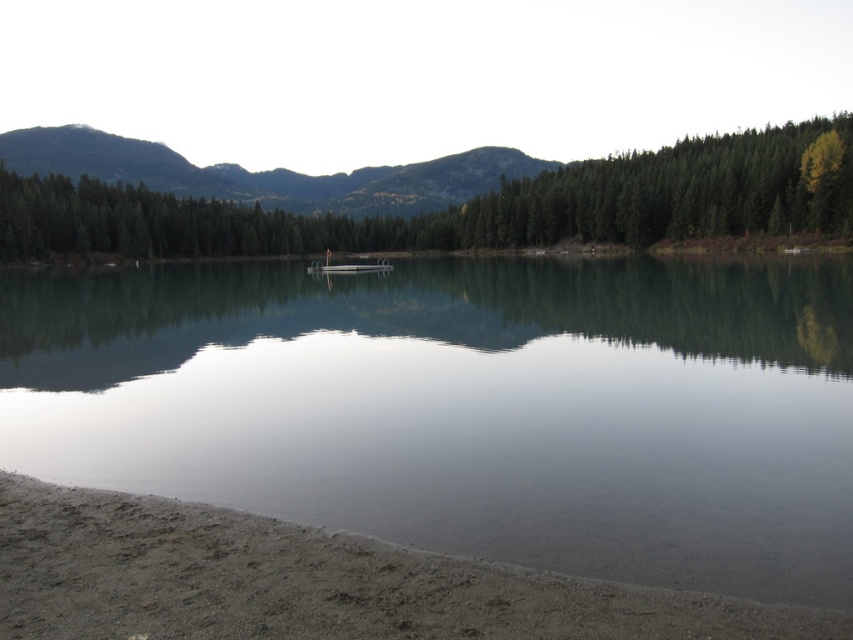
Is point (575, 216) closer to camera compared to point (328, 268)?

No.

Identify the location of green matte trees at upper center. Image resolution: width=853 pixels, height=640 pixels. (461, 205).

Does green forested mountain at upper left have a larger size compared to metallic silver boat at center?

Yes, green forested mountain at upper left is bigger than metallic silver boat at center.

Can you confirm if green forested mountain at upper left is positioned to the right of metallic silver boat at center?

No, green forested mountain at upper left is not to the right of metallic silver boat at center.

Which is in front, point (187, 172) or point (358, 264)?

Point (358, 264) is in front.

This screenshot has height=640, width=853. Find the location of `green forested mountain at upper left`. green forested mountain at upper left is located at coordinates (265, 173).

How distant is sandy shore at lower left from green matte trees at upper center?

The distance of sandy shore at lower left from green matte trees at upper center is 664.96 feet.

Identify the location of sandy shore at lower left. (312, 582).